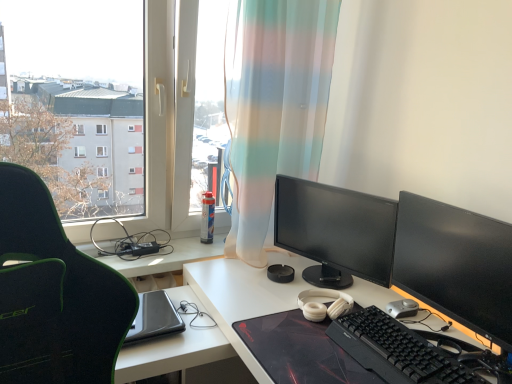
Question: From their relative heights in the image, would you say black plastic keyboard at lower right is taller or shorter than translucent fabric curtain at center?

Choices:
 (A) short
 (B) tall

Answer: (A)

Question: From a real-world perspective, is black plastic keyboard at lower right physically located above or below translucent fabric curtain at center?

Choices:
 (A) below
 (B) above

Answer: (A)

Question: Estimate the real-world distances between objects in this image. Which object is farther from the translucent fabric curtain at center?

Choices:
 (A) black glossy monitor at right, the second computer monitor viewed from the back
 (B) white matte headphones at center
 (C) matte black monitor at center, positioned as the 2th computer monitor in front-to-back order
 (D) transparent plastic window at upper left
 (E) white matte desk at center

Answer: (A)

Question: Estimate the real-world distances between objects in this image. Which object is farther from the black plastic keyboard at lower right?

Choices:
 (A) white matte headphones at center
 (B) black textured mousepad at center
 (C) silver metallic mouse at lower right
 (D) translucent fabric curtain at center
 (E) transparent plastic window at upper left

Answer: (E)